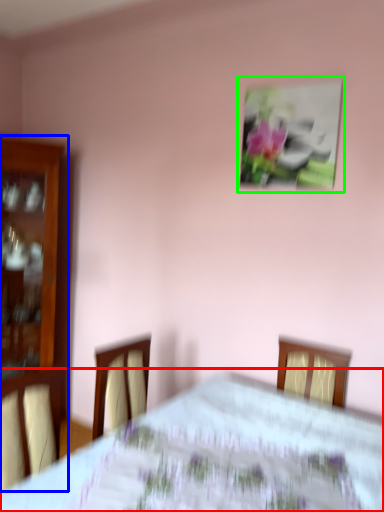
Question: Which object is positioned farthest from bed (highlighted by a red box)? Select from furniture (highlighted by a blue box) and picture frame (highlighted by a green box).

Choices:
 (A) furniture
 (B) picture frame

Answer: (A)